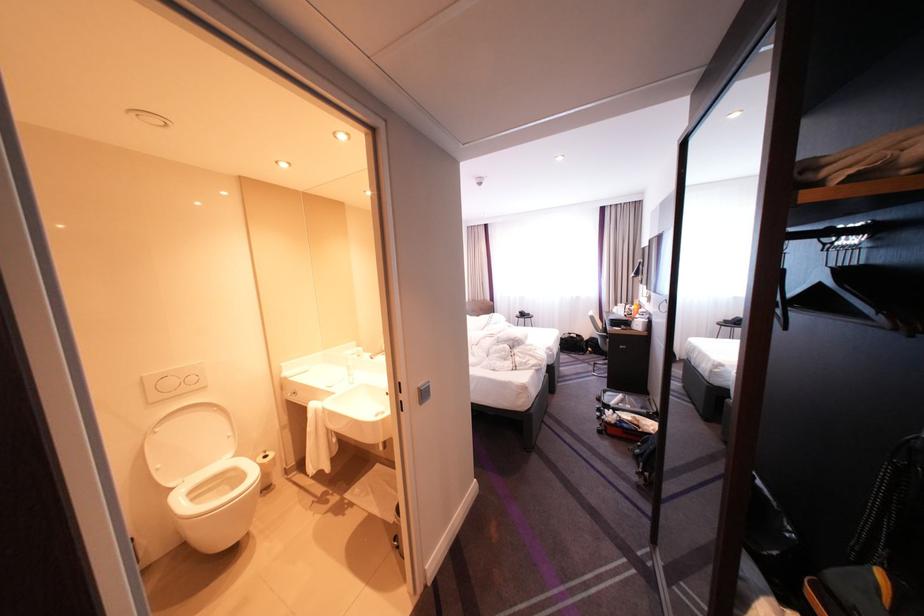
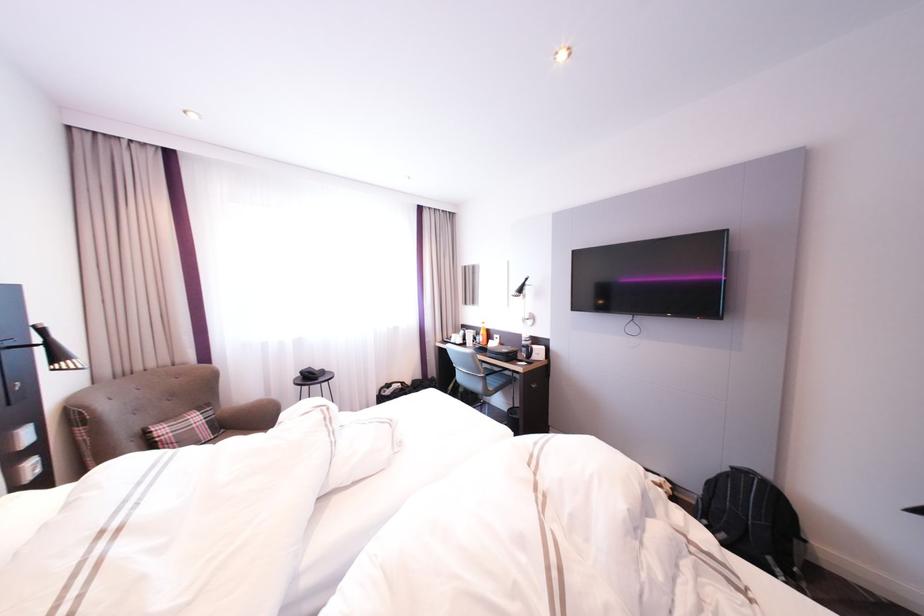
Where in the second image is the point corresponding to pixel 610 331 from the first image?

(492, 373)